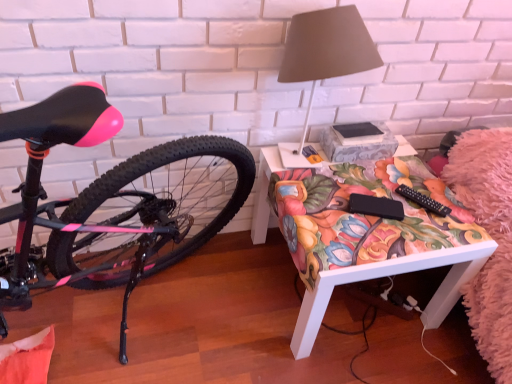
Locate an element on the screen. unoccupied area behind black plastic remote control at lower right is located at coordinates (410, 176).